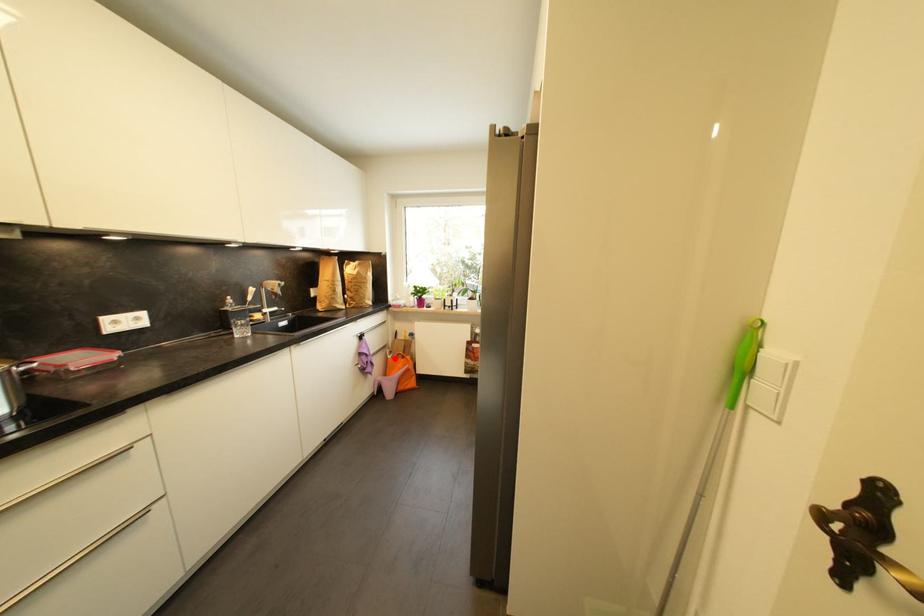
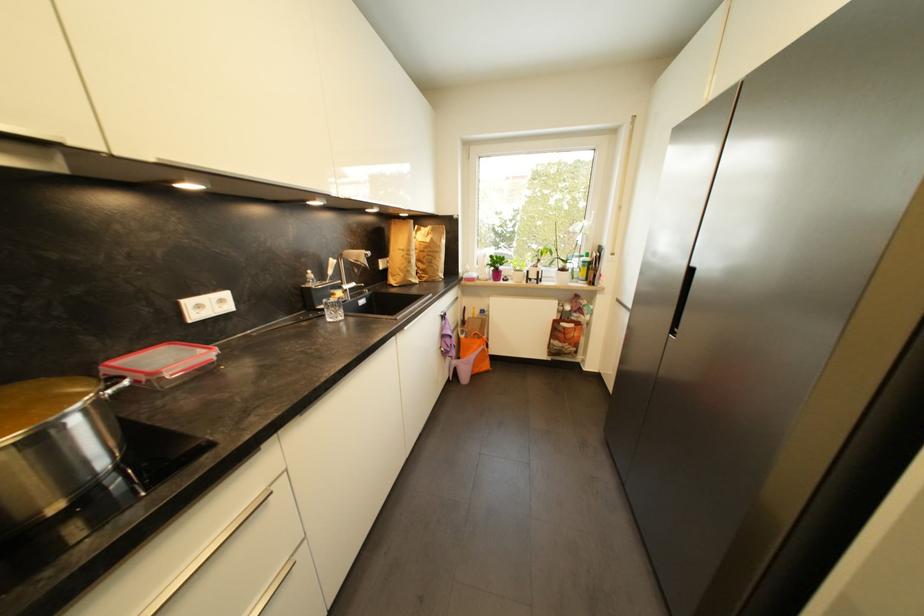
Where in the second image is the point corresponding to the highlighted location from the first image?

(468, 339)